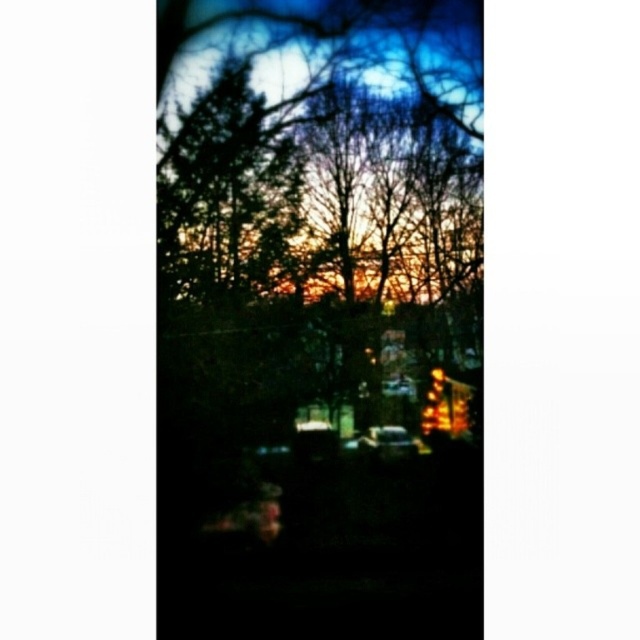
Question: Which of the following is the farthest from the observer?

Choices:
 (A) (388, 433)
 (B) (385, 282)

Answer: (B)

Question: Is the position of silhouetted bare branches at center more distant than that of shiny silver car at center?

Choices:
 (A) yes
 (B) no

Answer: (B)

Question: Is silhouetted bare branches at center to the right of shiny silver car at center from the viewer's perspective?

Choices:
 (A) yes
 (B) no

Answer: (B)

Question: Is silhouetted bare branches at center positioned behind shiny silver car at center?

Choices:
 (A) yes
 (B) no

Answer: (B)

Question: Which of the following is the closest to the observer?

Choices:
 (A) shiny silver car at center
 (B) silhouetted bare branches at center

Answer: (B)